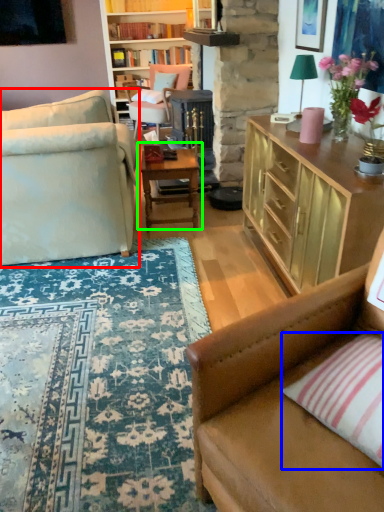
Question: Which object is positioned closest to studio couch (highlighted by a red box)? Select from pillow (highlighted by a blue box) and table (highlighted by a green box).

Choices:
 (A) pillow
 (B) table

Answer: (B)